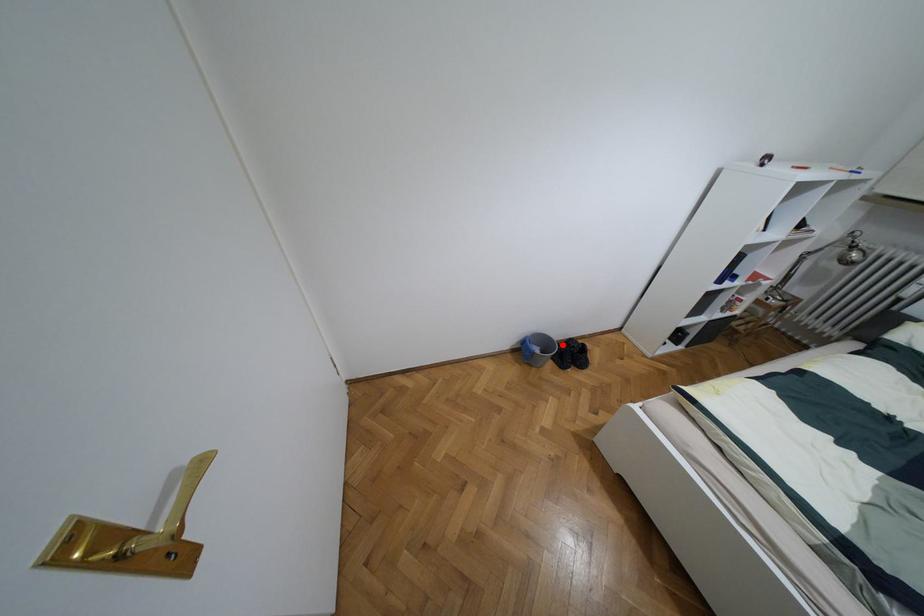
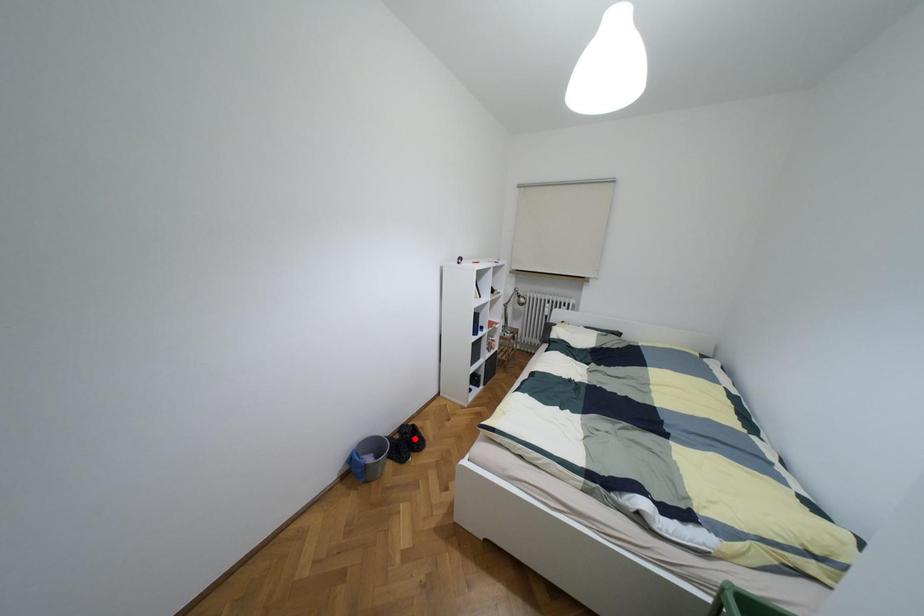
I am providing you with two images of the same scene from different viewpoints. A red point is marked on the first image and another point is marked on the second image. Do the highlighted points in image1 and image2 indicate the same real-world spot?

No